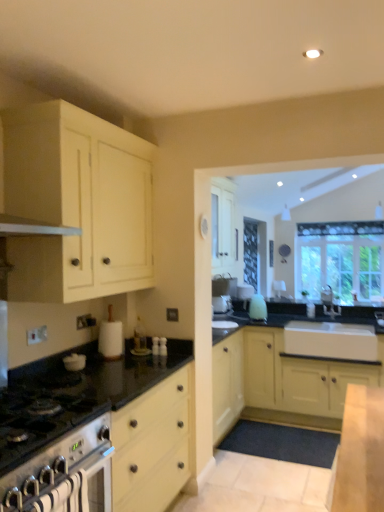
This screenshot has width=384, height=512. Identify the location of matte cream cabinet at upper left, acting as the 1th cabinetry starting from the front. (77, 204).

You are a GUI agent. You are given a task and a screenshot of the screen. Output one action in this format:
    pyautogui.click(x=<x>, y=<y>)
    Task: Click on the white matte paper towel holder at center, positioned as the 1th appliance in back-to-front order
    This screenshot has height=512, width=384.
    Given the screenshot: What is the action you would take?
    pyautogui.click(x=110, y=337)

Find the location of a particular element. This screenshot has width=384, height=512. black granite countertop at lower left is located at coordinates (97, 434).

The height and width of the screenshot is (512, 384). What do you see at coordinates (341, 258) in the screenshot? I see `clear glass window at upper right` at bounding box center [341, 258].

The height and width of the screenshot is (512, 384). I want to click on matte cream cabinet at upper left, acting as the 1th cabinetry starting from the front, so click(x=77, y=204).

Looking at this image, from a real-world perspective, which object rests below the other?

black granite countertop at lower left, from a real-world perspective.

Which object is wider, white glossy kettle at lower left, the 2th appliance when ordered from right to left, or black granite countertop at lower left?

black granite countertop at lower left is wider.

Is white glossy kettle at lower left, the 2th appliance when ordered from right to left, positioned far away from black granite countertop at lower left?

That's not correct — white glossy kettle at lower left, the 2th appliance when ordered from right to left, is a little close to black granite countertop at lower left.

Where is `countertop located underneath the white glossy kettle at lower left, the 2th appliance when ordered from right to left (from a real-world perspective)`? The height and width of the screenshot is (512, 384). countertop located underneath the white glossy kettle at lower left, the 2th appliance when ordered from right to left (from a real-world perspective) is located at coordinates (97, 434).

Could you tell me if matte cream cabinet at upper left, which is counted as the first cabinetry, starting from the left, is facing stainless steel oven at lower left?

No, matte cream cabinet at upper left, which is counted as the first cabinetry, starting from the left, is not aimed at stainless steel oven at lower left.

Which of these two, matte cream cabinet at upper left, placed as the 2th cabinetry when sorted from right to left, or stainless steel oven at lower left, stands taller?

matte cream cabinet at upper left, placed as the 2th cabinetry when sorted from right to left, is taller.

Considering the sizes of objects matte cream cabinet at upper left, which is counted as the first cabinetry, starting from the left, and stainless steel oven at lower left in the image provided, who is smaller, matte cream cabinet at upper left, which is counted as the first cabinetry, starting from the left, or stainless steel oven at lower left?

With smaller size is stainless steel oven at lower left.

Is matte cream cabinet at upper left, the second cabinetry from the bottom, behind stainless steel oven at lower left?

That is True.

Considering the relative sizes of clear glass window at upper right and matte yellow cabinet at center, positioned as the second cabinetry in left-to-right order, in the image provided, is clear glass window at upper right thinner than matte yellow cabinet at center, positioned as the second cabinetry in left-to-right order,?

Yes, clear glass window at upper right is thinner than matte yellow cabinet at center, positioned as the second cabinetry in left-to-right order.

Where is `cabinetry located below the clear glass window at upper right (from the image's perspective)`? cabinetry located below the clear glass window at upper right (from the image's perspective) is located at coordinates (282, 382).

Is matte yellow cabinet at center, the 1th cabinetry when ordered from bottom to top, located within clear glass window at upper right?

No, matte yellow cabinet at center, the 1th cabinetry when ordered from bottom to top, is not inside clear glass window at upper right.

Which is closer, (x=380, y=295) or (x=286, y=376)?

Point (x=286, y=376)

Is black granite countertop at lower left oriented away from white glossy kettle at lower left, which is counted as the 2th appliance, starting from the back?

That's right, black granite countertop at lower left is facing away from white glossy kettle at lower left, which is counted as the 2th appliance, starting from the back.

How different are the orientations of black granite countertop at lower left and white glossy kettle at lower left, which is the first appliance in left-to-right order, in degrees?

1.8 degrees.

From a real-world perspective, is black granite countertop at lower left located higher than white glossy kettle at lower left, the 2th appliance when ordered from right to left?

Incorrect, from a real-world perspective, black granite countertop at lower left is lower than white glossy kettle at lower left, the 2th appliance when ordered from right to left.

From the image's perspective, which object appears higher, white glossy kettle at lower left, which is the first appliance in left-to-right order, or stainless steel oven at lower left?

white glossy kettle at lower left, which is the first appliance in left-to-right order, appears higher in the image.

Considering the points (69, 366) and (79, 435), which point is in front, point (69, 366) or point (79, 435)?

The point (79, 435) is closer to the camera.

Is white glossy kettle at lower left, which is the first appliance in left-to-right order, wider than stainless steel oven at lower left?

No.

Relative to stainless steel oven at lower left, is white glossy kettle at lower left, which is the first appliance in left-to-right order, in front or behind?

Visually, white glossy kettle at lower left, which is the first appliance in left-to-right order, is located behind stainless steel oven at lower left.

From the image's perspective, is stainless steel oven at lower left on top of black granite countertop at lower left?

No, from the image's perspective, stainless steel oven at lower left is not over black granite countertop at lower left.

Would you say stainless steel oven at lower left is outside black granite countertop at lower left?

That's correct, stainless steel oven at lower left is outside of black granite countertop at lower left.

Is point (93, 490) closer to viewer compared to point (140, 388)?

That is True.

Between white glossy kettle at lower left, which is the first appliance in left-to-right order, and clear glass window at upper right, which one has smaller size?

white glossy kettle at lower left, which is the first appliance in left-to-right order.

From the image's perspective, does white glossy kettle at lower left, which is counted as the 2th appliance, starting from the back, appear lower than clear glass window at upper right?

Yes.

Which of these two, white glossy kettle at lower left, which is the first appliance in left-to-right order, or clear glass window at upper right, stands shorter?

white glossy kettle at lower left, which is the first appliance in left-to-right order.

Would you say white glossy kettle at lower left, which is counted as the 2th appliance, starting from the back, is inside or outside clear glass window at upper right?

white glossy kettle at lower left, which is counted as the 2th appliance, starting from the back, is spatially situated outside clear glass window at upper right.

Where is `countertop below the white glossy kettle at lower left, which is counted as the 2th appliance, starting from the back (from the image's perspective)`? The width and height of the screenshot is (384, 512). countertop below the white glossy kettle at lower left, which is counted as the 2th appliance, starting from the back (from the image's perspective) is located at coordinates (97, 434).

Locate an element on the screen. This screenshot has height=512, width=384. oven located in front of the matte cream cabinet at upper left, which is counted as the first cabinetry, starting from the left is located at coordinates (64, 474).

Estimate the real-world distances between objects in this image. Which object is further from black granite countertop at lower left, matte yellow cabinet at center, which is the first cabinetry in right-to-left order, or white matte paper towel holder at center, which ranks as the second appliance in left-to-right order?

matte yellow cabinet at center, which is the first cabinetry in right-to-left order, is further to black granite countertop at lower left.

Estimate the real-world distances between objects in this image. Which object is further from black granite countertop at lower left, stainless steel oven at lower left or white matte paper towel holder at center, the 1th appliance in the right-to-left sequence?

white matte paper towel holder at center, the 1th appliance in the right-to-left sequence, is further to black granite countertop at lower left.

When comparing their distances from black granite countertop at lower left, does matte cream cabinet at upper left, the second cabinetry from the bottom, or clear glass window at upper right seem closer?

matte cream cabinet at upper left, the second cabinetry from the bottom, is positioned closer to the anchor black granite countertop at lower left.

When comparing their distances from clear glass window at upper right, does black granite countertop at lower left or white matte paper towel holder at center, which is the 2th appliance from front to back, seem closer?

white matte paper towel holder at center, which is the 2th appliance from front to back, is closer to clear glass window at upper right.

Based on their spatial positions, is white glossy kettle at lower left, positioned as the first appliance in front-to-back order, or matte cream cabinet at upper left, the first cabinetry positioned from the top, closer to matte yellow cabinet at center, which is the first cabinetry in right-to-left order?

matte cream cabinet at upper left, the first cabinetry positioned from the top.

Looking at the image, which one is located further to clear glass window at upper right, matte yellow cabinet at center, the 1th cabinetry when ordered from bottom to top, or black granite countertop at lower left?

black granite countertop at lower left.

Which object lies nearer to the anchor point clear glass window at upper right, matte cream cabinet at upper left, the second cabinetry from the bottom, or white matte paper towel holder at center, the 1th appliance in the right-to-left sequence?

white matte paper towel holder at center, the 1th appliance in the right-to-left sequence, is positioned closer to the anchor clear glass window at upper right.

When comparing their distances from white matte paper towel holder at center, which ranks as the second appliance in left-to-right order, does white glossy kettle at lower left, which is the first appliance in left-to-right order, or matte yellow cabinet at center, the 1th cabinetry when ordered from bottom to top, seem further?

matte yellow cabinet at center, the 1th cabinetry when ordered from bottom to top.

Find the location of `appliance between matte cream cabinet at upper left, which is counted as the first cabinetry, starting from the left, and matte yellow cabinet at center, positioned as the second cabinetry in left-to-right order, in the horizontal direction`. appliance between matte cream cabinet at upper left, which is counted as the first cabinetry, starting from the left, and matte yellow cabinet at center, positioned as the second cabinetry in left-to-right order, in the horizontal direction is located at coordinates (110, 337).

The image size is (384, 512). I want to click on countertop situated between white matte paper towel holder at center, which ranks as the second appliance in left-to-right order, and matte yellow cabinet at center, which ranks as the 2th cabinetry in top-to-bottom order, from left to right, so click(x=97, y=434).

This screenshot has width=384, height=512. Find the location of `cabinetry between white matte paper towel holder at center, which is the 2th appliance from front to back, and clear glass window at upper right, along the z-axis`. cabinetry between white matte paper towel holder at center, which is the 2th appliance from front to back, and clear glass window at upper right, along the z-axis is located at coordinates (282, 382).

Where is `cabinetry between black granite countertop at lower left and matte yellow cabinet at center, which is the first cabinetry in right-to-left order, along the z-axis`? cabinetry between black granite countertop at lower left and matte yellow cabinet at center, which is the first cabinetry in right-to-left order, along the z-axis is located at coordinates (77, 204).